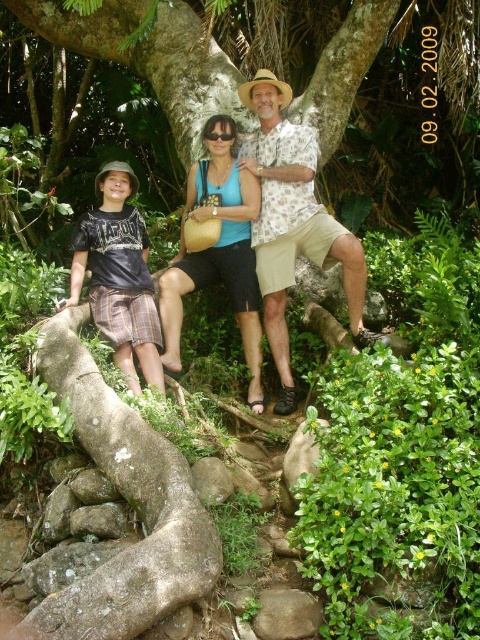
You are a photographer trying to capture a closeup of the matte black shorts at center and the blue fabric bag at center. Which object should you focus on first if you want to ensure both are in focus without adjusting the camera settings?

The matte black shorts at center is taller than the blue fabric bag at center, so focusing on the taller object first would help ensure both are in focus since it is farther away.

You are standing in the forest scene and want to walk from point (276, 120) to point (216, 147). Which direction should you move to get closer to your destination?

You should move away from the viewer because point (276, 120) is further to the viewer than point (216, 147).